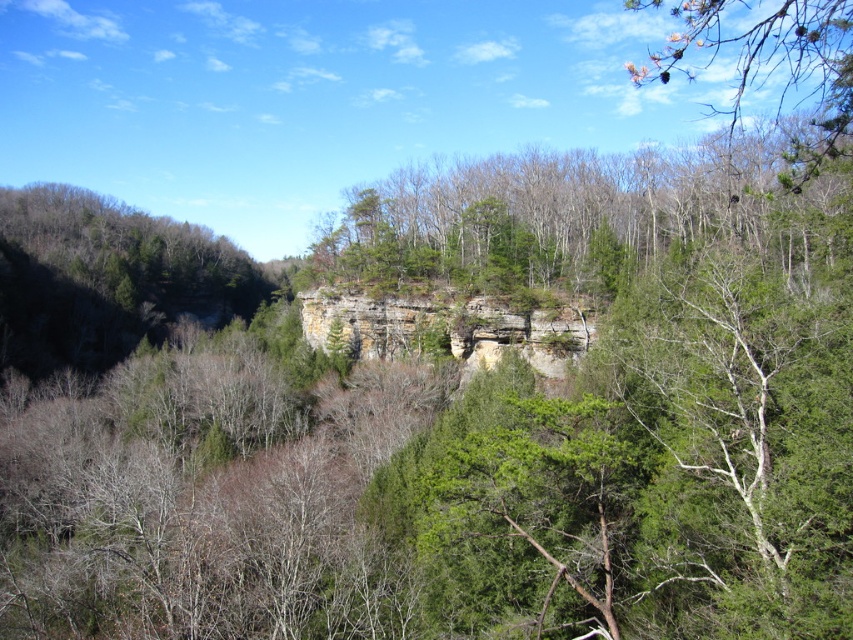
Question: Does green leafy tree at center come in front of rustic stone cliff at center?

Choices:
 (A) no
 (B) yes

Answer: (B)

Question: Among these points, which one is farthest from the camera?

Choices:
 (A) (550, 323)
 (B) (700, 22)
 (C) (775, 243)

Answer: (A)

Question: Which point appears farthest from the camera in this image?

Choices:
 (A) (x=596, y=182)
 (B) (x=332, y=301)
 (C) (x=735, y=3)

Answer: (C)

Question: Does green leafy tree at center appear under rustic stone cliff at center?

Choices:
 (A) no
 (B) yes

Answer: (A)

Question: Which point is closer to the camera?

Choices:
 (A) rustic stone cliff at center
 (B) green textured pine branch at upper right
 (C) green leafy tree at center

Answer: (B)

Question: Does green leafy tree at center appear on the left side of rustic stone cliff at center?

Choices:
 (A) no
 (B) yes

Answer: (A)